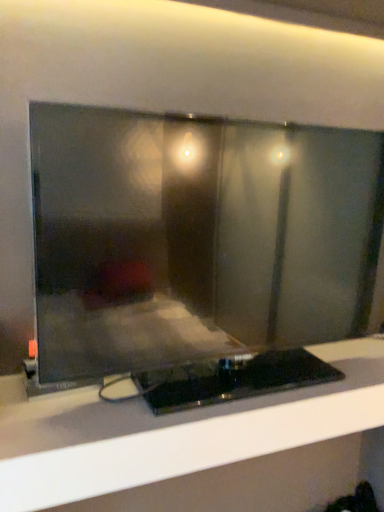
Question: Is black glossy tv stand at center beside matte black monitor at center?

Choices:
 (A) yes
 (B) no

Answer: (B)

Question: Does black glossy tv stand at center have a lesser width compared to matte black monitor at center?

Choices:
 (A) yes
 (B) no

Answer: (B)

Question: Is black glossy tv stand at center shorter than matte black monitor at center?

Choices:
 (A) no
 (B) yes

Answer: (B)

Question: Considering the relative sizes of black glossy tv stand at center and matte black monitor at center in the image provided, is black glossy tv stand at center taller than matte black monitor at center?

Choices:
 (A) yes
 (B) no

Answer: (B)

Question: Considering the relative sizes of black glossy tv stand at center and matte black monitor at center in the image provided, is black glossy tv stand at center wider than matte black monitor at center?

Choices:
 (A) yes
 (B) no

Answer: (A)

Question: Can you confirm if black glossy tv stand at center is positioned to the left of matte black monitor at center?

Choices:
 (A) no
 (B) yes

Answer: (A)

Question: Does matte black monitor at center have a lesser height compared to black glossy tv stand at center?

Choices:
 (A) no
 (B) yes

Answer: (A)

Question: Can you confirm if matte black monitor at center is smaller than black glossy tv stand at center?

Choices:
 (A) yes
 (B) no

Answer: (B)

Question: Is matte black monitor at center next to black glossy tv stand at center?

Choices:
 (A) yes
 (B) no

Answer: (B)

Question: Can you confirm if matte black monitor at center is thinner than black glossy tv stand at center?

Choices:
 (A) no
 (B) yes

Answer: (B)

Question: Could you tell me if matte black monitor at center is facing black glossy tv stand at center?

Choices:
 (A) yes
 (B) no

Answer: (B)

Question: From the image's perspective, is matte black monitor at center below black glossy tv stand at center?

Choices:
 (A) yes
 (B) no

Answer: (B)

Question: In the image, is matte black monitor at center positioned in front of or behind black glossy tv stand at center?

Choices:
 (A) front
 (B) behind

Answer: (A)